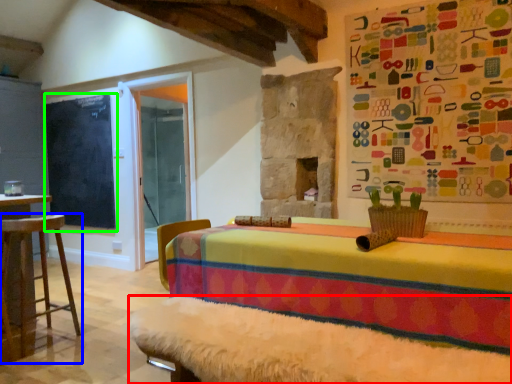
Question: Considering the real-world distances, which object is closest to bed frame (highlighted by a red box)? furniture (highlighted by a blue box) or bulletin board (highlighted by a green box).

Choices:
 (A) furniture
 (B) bulletin board

Answer: (A)